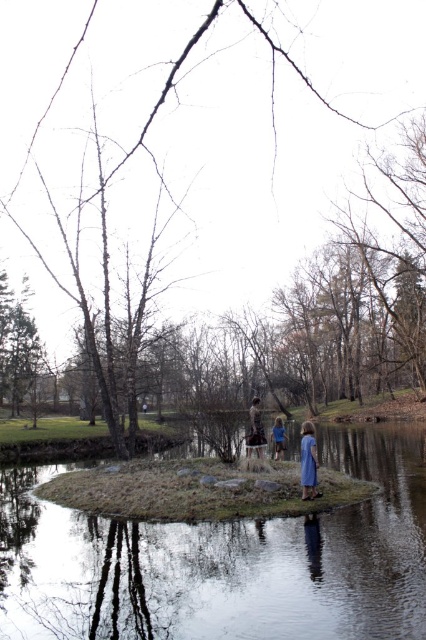
Based on the photo, in the serene outdoor scene with the small island, there are two people wearing a blue cotton dress at center and a dark brown leather jacket at center. Which one is positioned more to the right side?

The blue cotton dress at center is positioned to the right of the dark brown leather jacket at center, so the blue cotton dress at center is more to the right side.

You are standing on the island and want to take a photo of the clear water at center and the dark brown leather jacket at center. Which object should you focus on first if you want to capture both in the same frame without moving the camera?

You should focus on the clear water at center first because it is closer to the viewer than the dark brown leather jacket at center, allowing both to be in focus if the depth of field is sufficient.